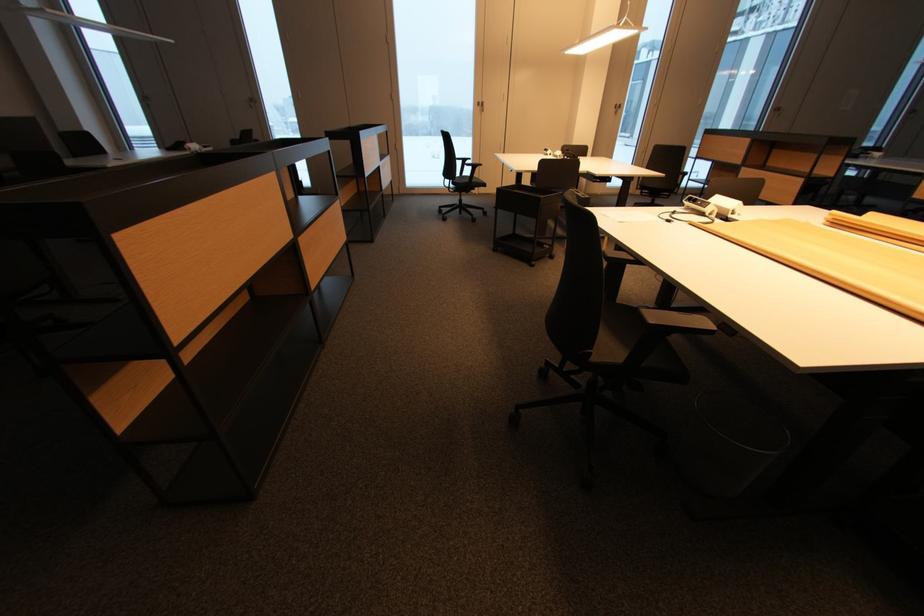
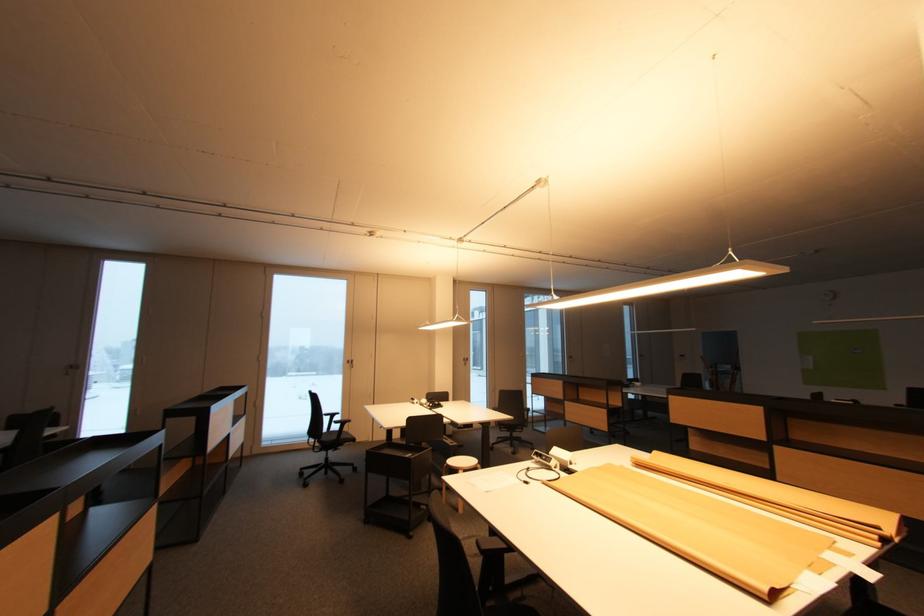
The first image is from the beginning of the video and the second image is from the end. How did the camera likely rotate when shooting the video?

The camera's rotation is toward right-up.